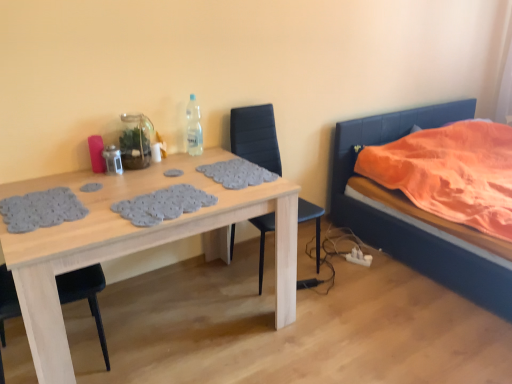
Question: From the image's perspective, is orange fabric bed at right positioned above or below black leather chair at center?

Choices:
 (A) above
 (B) below

Answer: (A)

Question: From their relative heights in the image, would you say orange fabric bed at right is taller or shorter than black leather chair at center?

Choices:
 (A) short
 (B) tall

Answer: (A)

Question: Based on their relative distances, which object is nearer to the wooden table at center?

Choices:
 (A) black leather chair at center
 (B) clear plastic bottle at upper center
 (C) orange fabric bed at right

Answer: (B)

Question: Which is nearer to the clear plastic bottle at upper center?

Choices:
 (A) orange fabric bed at right
 (B) black leather chair at center
 (C) wooden table at center

Answer: (B)